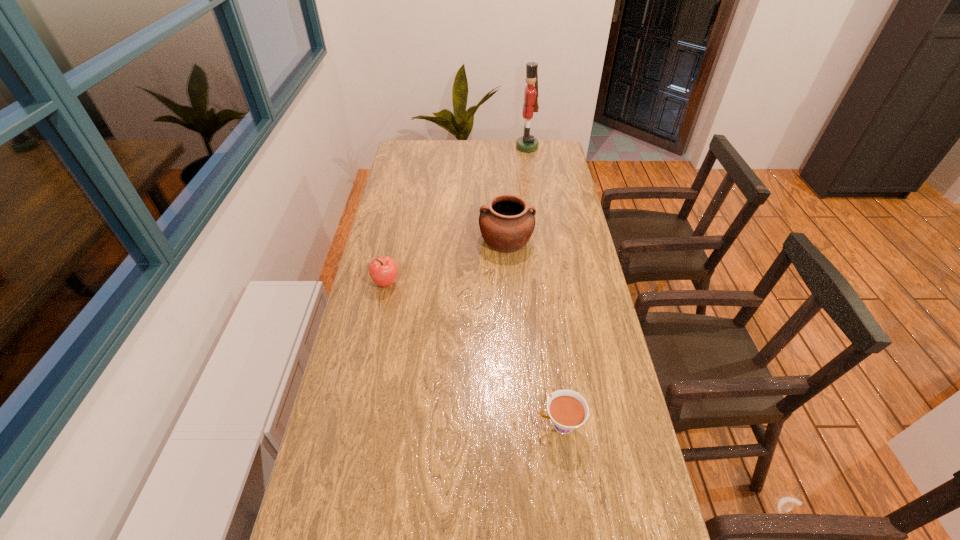
Locate an element on the screen. vacant space located 0.310m on the front-facing side of the tallest object is located at coordinates (450, 147).

At what (x,y) coordinates should I click in order to perform the action: click on vacant space situated on the back of the second tallest object. Please return your answer as a coordinate pair (x, y). The width and height of the screenshot is (960, 540). Looking at the image, I should click on (501, 167).

The height and width of the screenshot is (540, 960). I want to click on vacant space situated on the right of the apple, so click(x=440, y=282).

At what (x,y) coordinates should I click in order to perform the action: click on blank space located on the side of the shortest object with the handle. Please return your answer as a coordinate pair (x, y). The image size is (960, 540). Looking at the image, I should click on (490, 425).

The image size is (960, 540). I want to click on blank space located on the side of the shortest object with the handle, so click(x=462, y=425).

Locate an element on the screen. This screenshot has height=540, width=960. free location located 0.140m on the side of the shortest object with the handle is located at coordinates (482, 425).

In order to click on object located in the far edge section of the desktop in this screenshot , I will do `click(527, 143)`.

This screenshot has height=540, width=960. What are the coordinates of `object that is positioned at the left edge` in the screenshot? It's located at pos(383,270).

Where is `nutcracker that is at the right edge`? The width and height of the screenshot is (960, 540). nutcracker that is at the right edge is located at coordinates (527, 143).

The image size is (960, 540). What are the coordinates of `teacup that is at the right edge` in the screenshot? It's located at (567, 409).